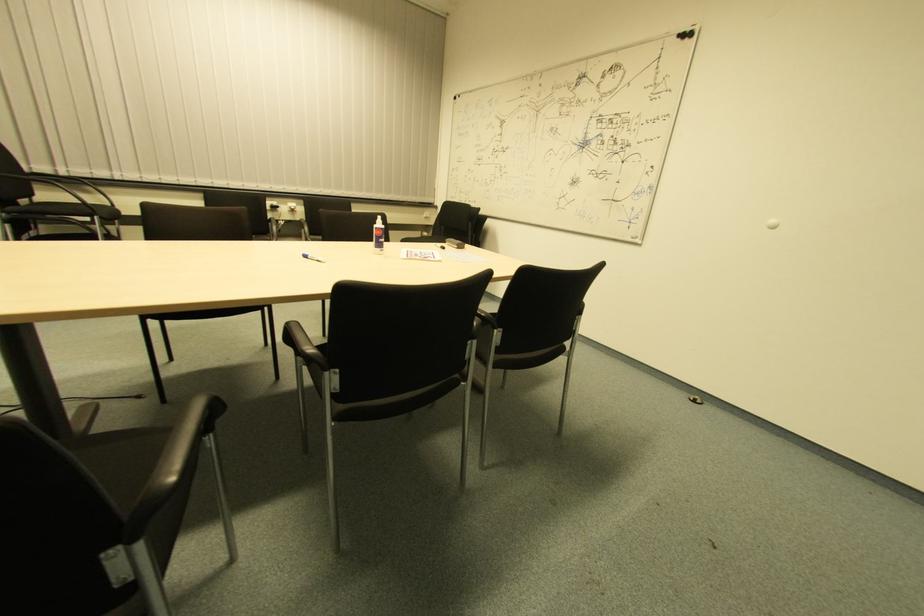
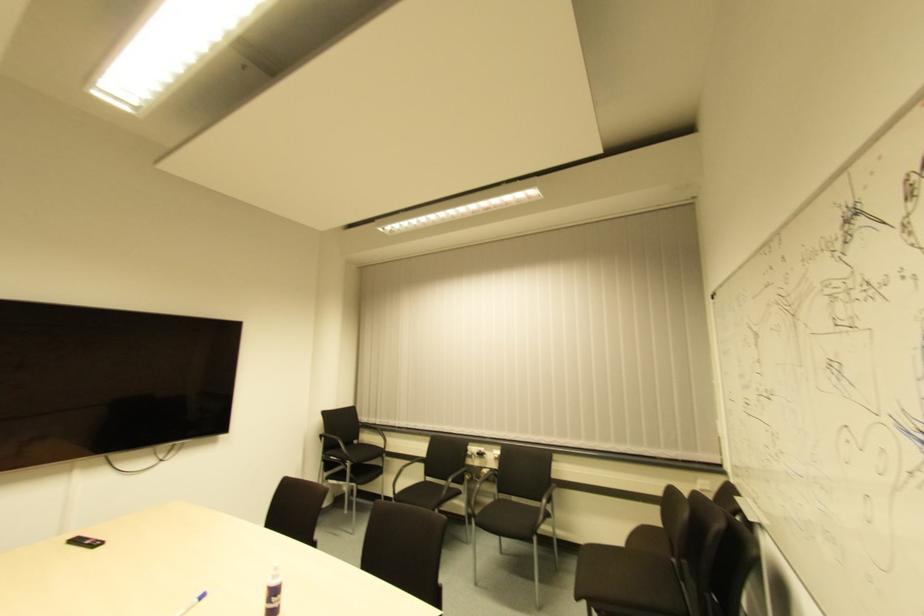
Locate, in the second image, the point that corresponds to point (265, 200) in the first image.

(468, 447)